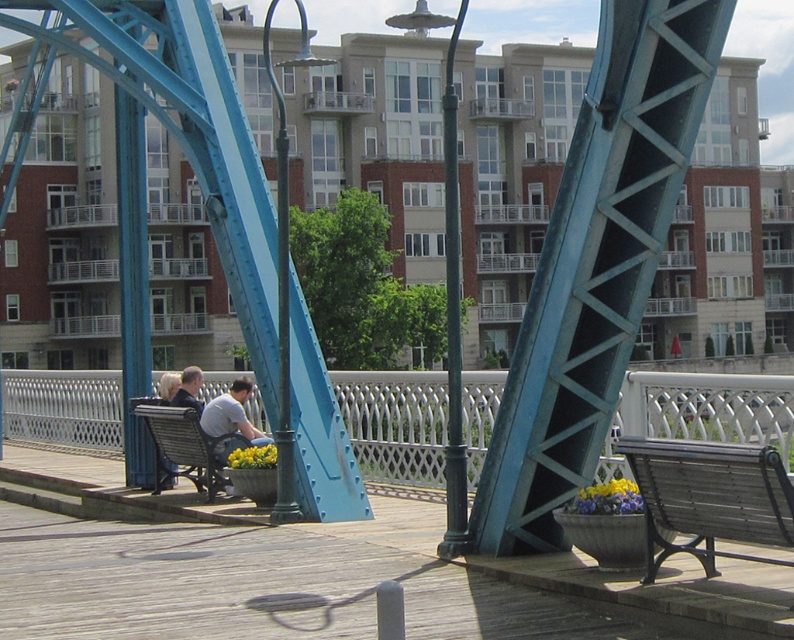
You are standing on the pedestrian bridge and want to sit down. Where is the wooden bench at center located in relation to the blue steel beams and white railings?

The wooden bench at center is located at coordinates point (180, 445), which is positioned on the bridge deck between the blue steel beams and white railings.